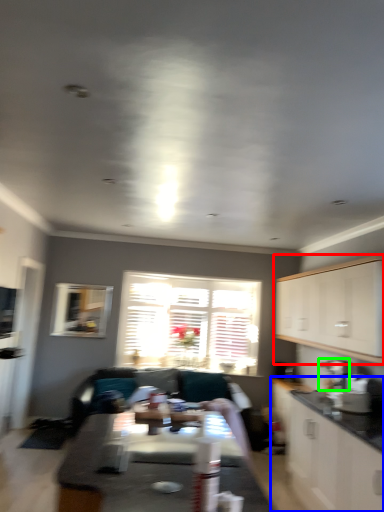
Question: Based on their relative distances, which object is farther from cabinetry (highlighted by a red box)? Choose from cabinetry (highlighted by a blue box) and appliance (highlighted by a green box).

Choices:
 (A) cabinetry
 (B) appliance

Answer: (A)